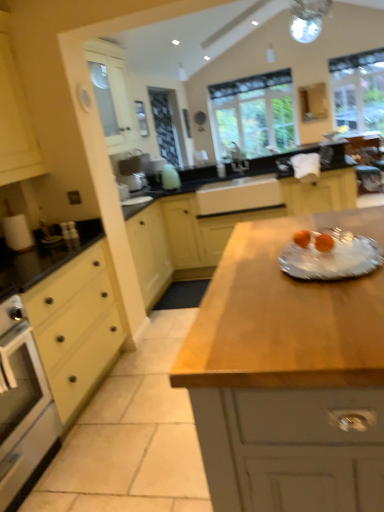
Identify the location of free location in front of clear glass plate at center. The height and width of the screenshot is (512, 384). (308, 316).